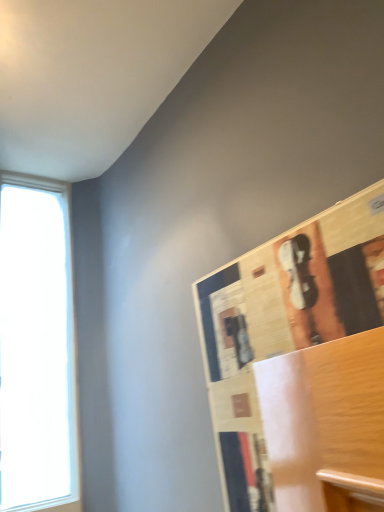
The width and height of the screenshot is (384, 512). What do you see at coordinates (36, 347) in the screenshot? I see `transparent glass window at left` at bounding box center [36, 347].

What are the coordinates of `transparent glass window at left` in the screenshot? It's located at (36, 347).

Identify the location of wooden bulletin board at upper right. The image size is (384, 512). click(284, 323).

What do you see at coordinates (284, 323) in the screenshot? I see `wooden bulletin board at upper right` at bounding box center [284, 323].

Measure the distance between point (354, 321) and camera.

The distance of point (354, 321) from camera is 20.94 inches.

Find the location of a particular element. This screenshot has width=384, height=512. transparent glass window at left is located at coordinates (36, 347).

Which object is positioned more to the left, wooden bulletin board at upper right or transparent glass window at left?

transparent glass window at left is more to the left.

Considering their positions, is wooden bulletin board at upper right located in front of or behind transparent glass window at left?

In the image, wooden bulletin board at upper right appears in front of transparent glass window at left.

Which is less distant, (359, 211) or (55, 457)?

Point (359, 211) is positioned closer to the camera compared to point (55, 457).

From the image's perspective, does wooden bulletin board at upper right appear higher than transparent glass window at left?

Yes, from the image's perspective, wooden bulletin board at upper right is above transparent glass window at left.

From a real-world perspective, is wooden bulletin board at upper right positioned above or below transparent glass window at left?

In terms of real-world spatial position, wooden bulletin board at upper right is below transparent glass window at left.

Which object is wider, wooden bulletin board at upper right or transparent glass window at left?

transparent glass window at left is wider.

Considering the sizes of wooden bulletin board at upper right and transparent glass window at left in the image, is wooden bulletin board at upper right taller or shorter than transparent glass window at left?

Clearly, wooden bulletin board at upper right is shorter compared to transparent glass window at left.

Looking at the image, does wooden bulletin board at upper right seem bigger or smaller compared to transparent glass window at left?

Considering their sizes, wooden bulletin board at upper right takes up less space than transparent glass window at left.

Is wooden bulletin board at upper right positioned beyond the bounds of transparent glass window at left?

That's correct, wooden bulletin board at upper right is outside of transparent glass window at left.

Can you see wooden bulletin board at upper right touching transparent glass window at left?

No, wooden bulletin board at upper right is not with transparent glass window at left.

Is wooden bulletin board at upper right turned away from transparent glass window at left?

No, wooden bulletin board at upper right is not facing the opposite direction of transparent glass window at left.

How much distance is there between wooden bulletin board at upper right and transparent glass window at left?

wooden bulletin board at upper right and transparent glass window at left are 26.60 inches apart from each other.

Identify the location of window on the left side of wooden bulletin board at upper right. Image resolution: width=384 pixels, height=512 pixels. (36, 347).

Between transparent glass window at left and wooden bulletin board at upper right, which one appears on the right side from the viewer's perspective?

From the viewer's perspective, wooden bulletin board at upper right appears more on the right side.

In the image, is transparent glass window at left positioned in front of or behind wooden bulletin board at upper right?

Clearly, transparent glass window at left is behind wooden bulletin board at upper right.

Is point (40, 306) positioned after point (341, 290)?

Yes, point (40, 306) is behind point (341, 290).

From the image's perspective, which is below, transparent glass window at left or wooden bulletin board at upper right?

From the image's view, transparent glass window at left is below.

From a real-world perspective, which is physically above, transparent glass window at left or wooden bulletin board at upper right?

transparent glass window at left is physically above.

In terms of width, does transparent glass window at left look wider or thinner when compared to wooden bulletin board at upper right?

In the image, transparent glass window at left appears to be wider than wooden bulletin board at upper right.

Does transparent glass window at left have a greater height compared to wooden bulletin board at upper right?

Yes, transparent glass window at left is taller than wooden bulletin board at upper right.

Can you confirm if transparent glass window at left is bigger than wooden bulletin board at upper right?

Indeed, transparent glass window at left has a larger size compared to wooden bulletin board at upper right.

Choose the correct answer: Is transparent glass window at left inside wooden bulletin board at upper right or outside it?

The correct answer is: outside.

Would you consider transparent glass window at left to be distant from wooden bulletin board at upper right?

That's not correct — transparent glass window at left is a little close to wooden bulletin board at upper right.

Is transparent glass window at left positioned with its back to wooden bulletin board at upper right?

transparent glass window at left does not have its back to wooden bulletin board at upper right.

How distant is transparent glass window at left from wooden bulletin board at upper right?

The distance of transparent glass window at left from wooden bulletin board at upper right is 26.60 inches.

Find the location of a particular element. The height and width of the screenshot is (512, 384). bulletin board that is under the transparent glass window at left (from a real-world perspective) is located at coordinates (284, 323).

Locate an element on the screen. window on the left of wooden bulletin board at upper right is located at coordinates [x=36, y=347].

Locate an element on the screen. bulletin board lying in front of the transparent glass window at left is located at coordinates (284, 323).